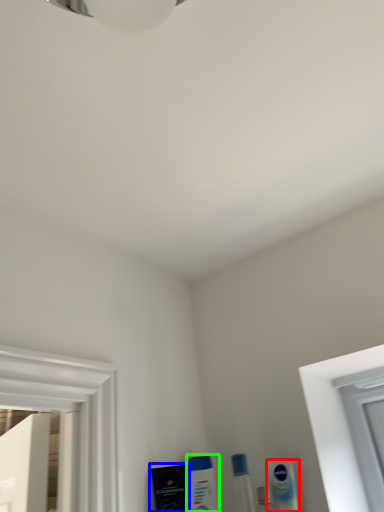
Question: Which object is the closest to the mouthwash (highlighted by a red box)? Choose among these: mouthwash (highlighted by a blue box) or mouthwash (highlighted by a green box).

Choices:
 (A) mouthwash
 (B) mouthwash

Answer: (B)